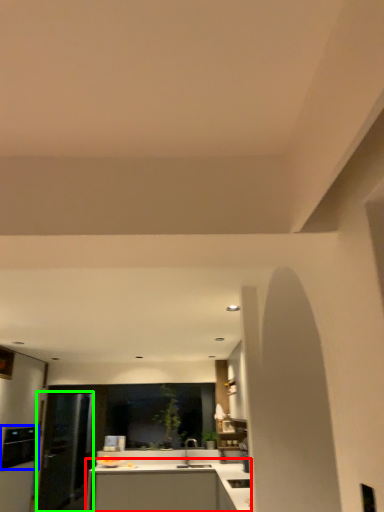
Question: Estimate the real-world distances between objects in this image. Which object is closer to countertop (highlighted by a red box), appliance (highlighted by a blue box) or glass door (highlighted by a green box)?

Choices:
 (A) appliance
 (B) glass door

Answer: (B)